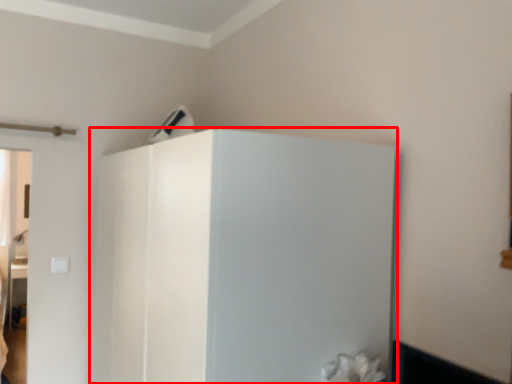
Question: Where is fridge (annotated by the red box) located in relation to appliance in the image?

Choices:
 (A) right
 (B) left

Answer: (A)